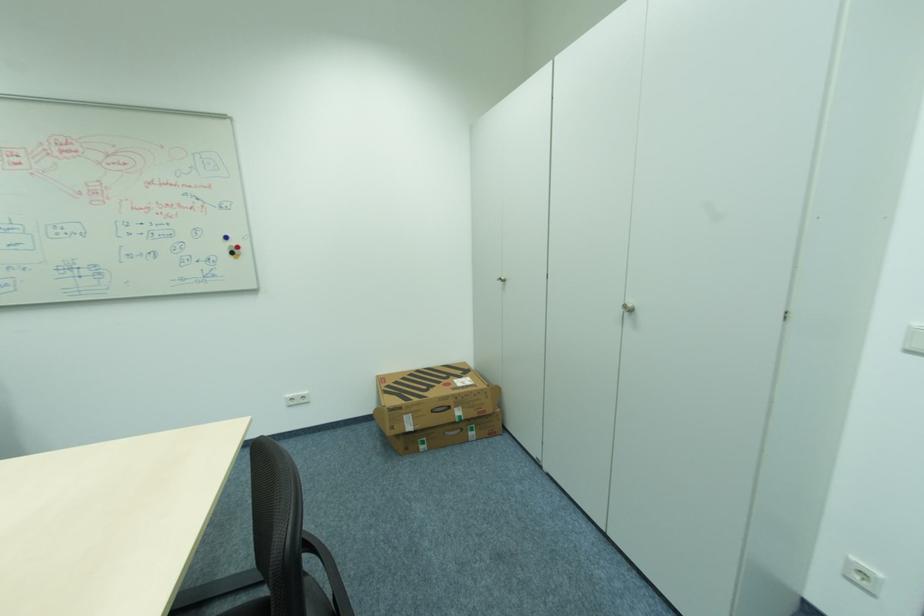
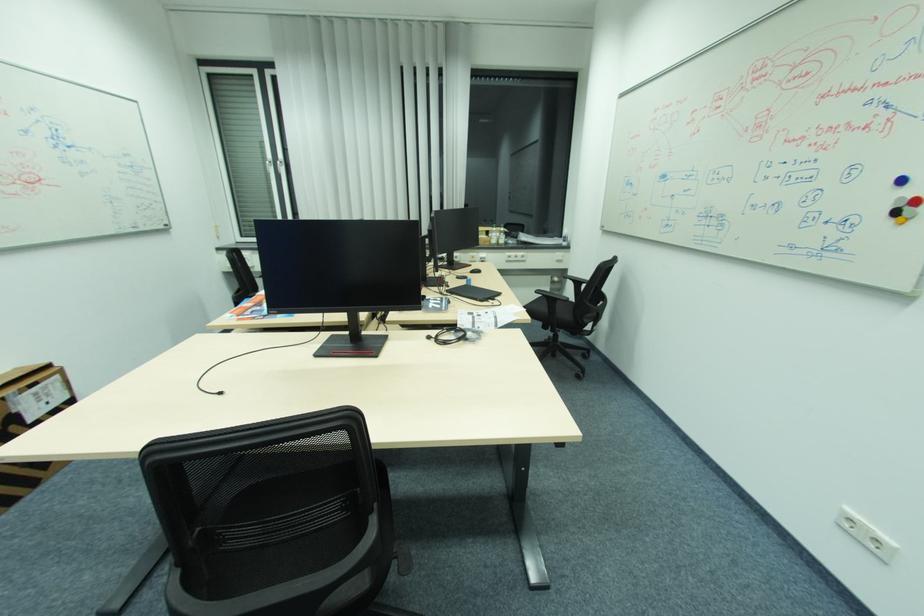
Where in the second image is the point corresponding to pixel 233 238 from the first image?

(908, 180)